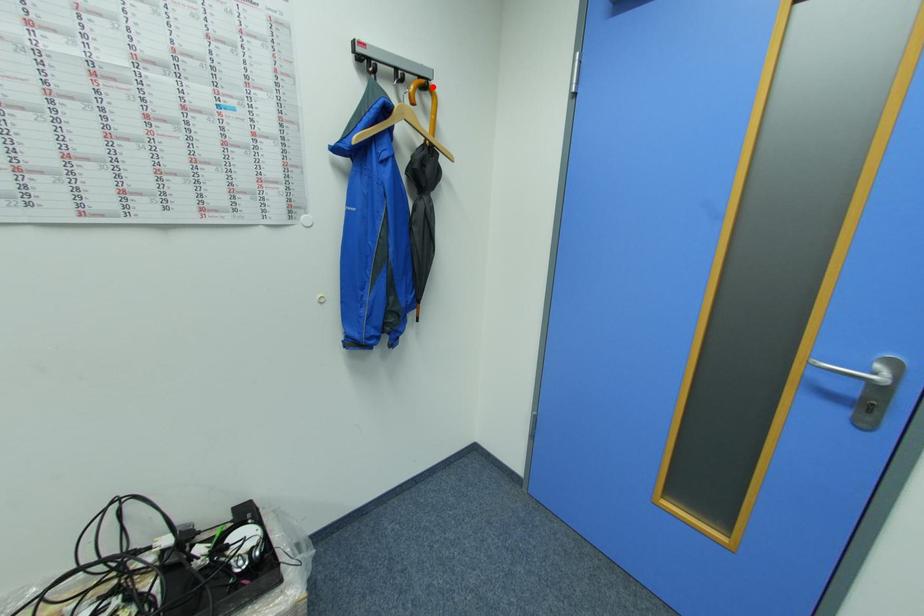
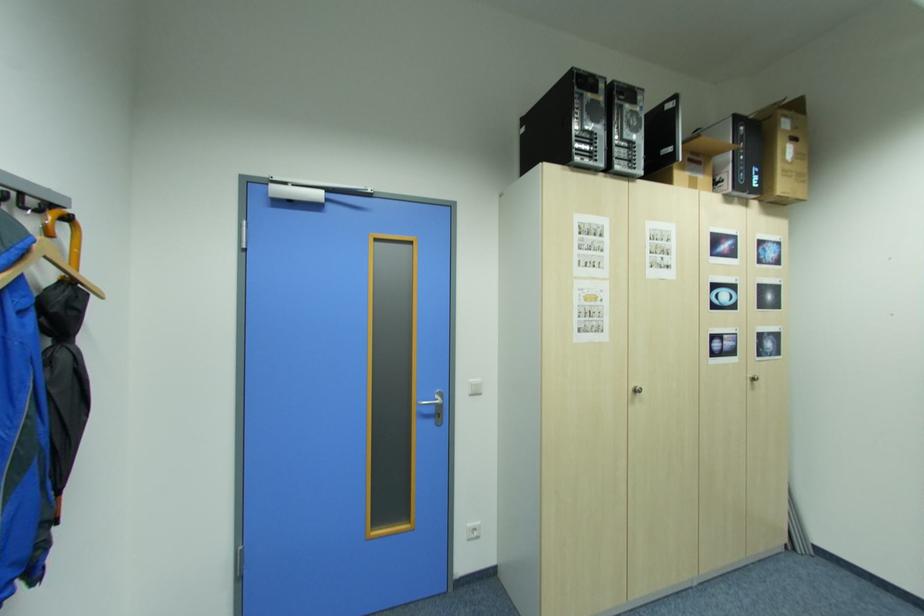
In the second image, find the point that corresponds to the highlighted location in the first image.

(76, 219)